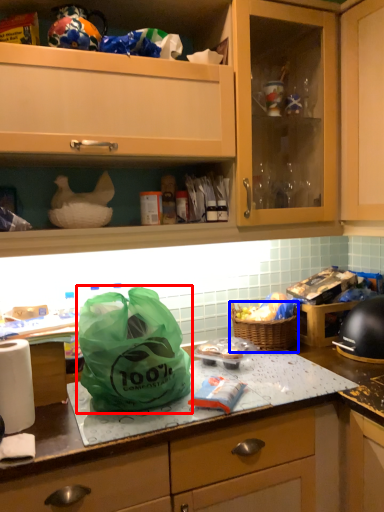
Question: Which point is closer to the camera, plastic bag (highlighted by a red box) or picnic basket (highlighted by a blue box)?

Choices:
 (A) plastic bag
 (B) picnic basket

Answer: (A)